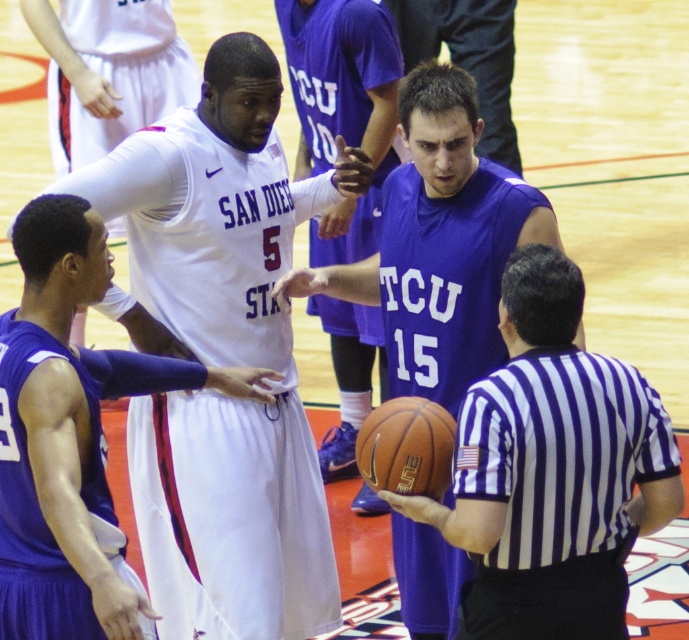
Does matte purple jersey at center appear on the left side of purple jersey at center?

No, matte purple jersey at center is not to the left of purple jersey at center.

Describe the element at coordinates (553, 468) in the screenshot. I see `matte purple jersey at center` at that location.

You are a GUI agent. You are given a task and a screenshot of the screen. Output one action in this format:
    pyautogui.click(x=<x>, y=<y>)
    Task: Click on the matte purple jersey at center
    This screenshot has height=640, width=689.
    Given the screenshot: What is the action you would take?
    pyautogui.click(x=553, y=468)

Between purple jersey at center and white jersey at center, which one has more height?

white jersey at center

Can you confirm if purple jersey at center is positioned above white jersey at center?

Actually, purple jersey at center is below white jersey at center.

Which is behind, point (367, 296) or point (367, 216)?

Positioned behind is point (367, 216).

Find the location of `purple jersey at center`. purple jersey at center is located at coordinates (440, 244).

Does point (298, 12) lie in front of point (389, 460)?

No, (298, 12) is further to viewer.

Looking at this image, which is above, white jersey at center or rubber textured basketball at center?

white jersey at center is higher up.

Where is `white jersey at center`? white jersey at center is located at coordinates (342, 108).